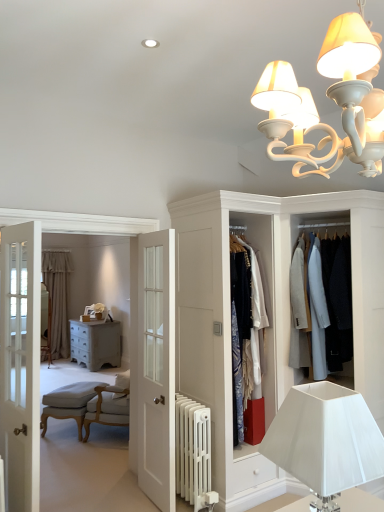
What is the approximate height of beige fabric curtain at left?

beige fabric curtain at left is 2.30 meters in height.

This screenshot has height=512, width=384. I want to click on white painted radiator at lower center, so click(192, 448).

What is the approximate width of silky fabric dress at center, which is counted as the 2th clothing, starting from the right?

silky fabric dress at center, which is counted as the 2th clothing, starting from the right, is 41.97 centimeters in width.

Describe the element at coordinates (68, 403) in the screenshot. I see `light beige fabric armchair at lower left` at that location.

Image resolution: width=384 pixels, height=512 pixels. What do you see at coordinates (156, 368) in the screenshot?
I see `white glossy door at center` at bounding box center [156, 368].

Measure the distance between light gray wool coat at center, marked as the second clothing in a left-to-right arrangement, and camera.

The depth of light gray wool coat at center, marked as the second clothing in a left-to-right arrangement, is 3.24 meters.

The image size is (384, 512). What do you see at coordinates (328, 304) in the screenshot?
I see `light gray wool coat at center, which is the first clothing from right to left` at bounding box center [328, 304].

Identify the location of white fabric lampshade at lower right, placed as the 1th lamp when sorted from bottom to top. (325, 441).

Where is `beige fabric curtain at left`? The image size is (384, 512). beige fabric curtain at left is located at coordinates (57, 298).

From the picture: Which of these two, white glossy door at center or distressed gray chest of drawers at center, is thinner?

white glossy door at center.

Is white glossy door at center inside the boundaries of distressed gray chest of drawers at center, or outside?

white glossy door at center exists outside the volume of distressed gray chest of drawers at center.

From the image's perspective, is white glossy door at center under distressed gray chest of drawers at center?

Actually, white glossy door at center appears above distressed gray chest of drawers at center in the image.

Can you tell me how much white glossy door at center and distressed gray chest of drawers at center differ in facing direction?

2.76 degrees.

Would you say beige fabric curtain at left is to the left or to the right of silky fabric dress at center, marked as the 1th clothing in a left-to-right arrangement, in the picture?

Based on their positions, beige fabric curtain at left is located to the left of silky fabric dress at center, marked as the 1th clothing in a left-to-right arrangement.

Which object is wider, beige fabric curtain at left or silky fabric dress at center, marked as the 1th clothing in a left-to-right arrangement?

silky fabric dress at center, marked as the 1th clothing in a left-to-right arrangement, is wider.

From the image's perspective, is beige fabric curtain at left located above or below silky fabric dress at center, which is counted as the 2th clothing, starting from the right?

beige fabric curtain at left is below silky fabric dress at center, which is counted as the 2th clothing, starting from the right.

From the picture: Is silky fabric dress at center, marked as the 1th clothing in a left-to-right arrangement, at the back of beige fabric curtain at left?

No, beige fabric curtain at left is not facing the opposite direction of silky fabric dress at center, marked as the 1th clothing in a left-to-right arrangement.

Considering the positions of objects white matte chandelier at upper center, which appears as the 2th lamp when ordered from the bottom, and white glossy door at center in the image provided, who is in front, white matte chandelier at upper center, which appears as the 2th lamp when ordered from the bottom, or white glossy door at center?

Positioned in front is white matte chandelier at upper center, which appears as the 2th lamp when ordered from the bottom.

Who is taller, white matte chandelier at upper center, the 1th lamp viewed from the top, or white glossy door at center?

Standing taller between the two is white glossy door at center.

Can you see white glossy door at center touching beige fabric curtain at left?

There is a gap between white glossy door at center and beige fabric curtain at left.

Does white glossy door at center come behind beige fabric curtain at left?

No, it is not.

Is point (139, 465) closer or farther from the camera than point (53, 257)?

Point (139, 465).

From the image's perspective, is silky fabric dress at center, marked as the 1th clothing in a left-to-right arrangement, beneath white painted radiator at lower center?

Incorrect, from the image's perspective, silky fabric dress at center, marked as the 1th clothing in a left-to-right arrangement, is higher than white painted radiator at lower center.

Considering the relative sizes of silky fabric dress at center, which is counted as the 2th clothing, starting from the right, and white painted radiator at lower center in the image provided, is silky fabric dress at center, which is counted as the 2th clothing, starting from the right, shorter than white painted radiator at lower center?

Incorrect, the height of silky fabric dress at center, which is counted as the 2th clothing, starting from the right, does not fall short of that of white painted radiator at lower center.

Who is smaller, silky fabric dress at center, which is counted as the 2th clothing, starting from the right, or white painted radiator at lower center?

white painted radiator at lower center is smaller.

How different are the orientations of silky fabric dress at center, which is counted as the 2th clothing, starting from the right, and white painted radiator at lower center in degrees?

The angle between the facing direction of silky fabric dress at center, which is counted as the 2th clothing, starting from the right, and the facing direction of white painted radiator at lower center is 3.83 degrees.

Based on their sizes in the image, would you say white painted radiator at lower center is bigger or smaller than silky fabric dress at center, marked as the 1th clothing in a left-to-right arrangement?

Clearly, white painted radiator at lower center is smaller in size than silky fabric dress at center, marked as the 1th clothing in a left-to-right arrangement.

Identify the location of radiator that is below the silky fabric dress at center, marked as the 1th clothing in a left-to-right arrangement (from the image's perspective). The image size is (384, 512). (192, 448).

Are white painted radiator at lower center and silky fabric dress at center, which is counted as the 2th clothing, starting from the right, making contact?

No, white painted radiator at lower center is not touching silky fabric dress at center, which is counted as the 2th clothing, starting from the right.

Does white painted radiator at lower center turn towards silky fabric dress at center, marked as the 1th clothing in a left-to-right arrangement?

No, white painted radiator at lower center is not aimed at silky fabric dress at center, marked as the 1th clothing in a left-to-right arrangement.

Considering the relative sizes of white glossy door at center and white painted radiator at lower center in the image provided, is white glossy door at center bigger than white painted radiator at lower center?

Correct, white glossy door at center is larger in size than white painted radiator at lower center.

Could white painted radiator at lower center be considered to be inside white glossy door at center?

No, white painted radiator at lower center is located outside of white glossy door at center.

Is white glossy door at center oriented towards white painted radiator at lower center?

Yes, white glossy door at center is facing white painted radiator at lower center.

Is white glossy door at center not near white painted radiator at lower center?

white glossy door at center is near white painted radiator at lower center, not far away.

Where is `the chest of drawers that appears behind the white glossy door at center`? The height and width of the screenshot is (512, 384). the chest of drawers that appears behind the white glossy door at center is located at coordinates (95, 343).

Locate an element on the screen. This screenshot has height=512, width=384. the 1st clothing above the beige fabric curtain at left (from the image's perspective) is located at coordinates (248, 335).

When comparing their distances from distressed gray chest of drawers at center, does white matte chandelier at upper center, which appears as the 2th lamp when ordered from the bottom, or beige fabric curtain at left seem further?

white matte chandelier at upper center, which appears as the 2th lamp when ordered from the bottom, is further to distressed gray chest of drawers at center.

Looking at the image, which one is located closer to light gray wool coat at center, which is the first clothing from right to left, light beige fabric armchair at lower left or beige fabric curtain at left?

light beige fabric armchair at lower left.

Looking at the image, which one is located closer to silky fabric dress at center, marked as the 1th clothing in a left-to-right arrangement, light beige fabric armchair at lower left or white fabric lampshade at lower right, the 2th lamp from the top?

white fabric lampshade at lower right, the 2th lamp from the top, is closer to silky fabric dress at center, marked as the 1th clothing in a left-to-right arrangement.

From the image, which object appears to be farther from white fabric lampshade at lower right, placed as the 1th lamp when sorted from bottom to top, silky fabric dress at center, marked as the 1th clothing in a left-to-right arrangement, or white painted radiator at lower center?

silky fabric dress at center, marked as the 1th clothing in a left-to-right arrangement, is further to white fabric lampshade at lower right, placed as the 1th lamp when sorted from bottom to top.

Considering their positions, is white painted radiator at lower center positioned closer to distressed gray chest of drawers at center than light beige fabric armchair at lower left?

light beige fabric armchair at lower left is positioned closer to the anchor distressed gray chest of drawers at center.

Estimate the real-world distances between objects in this image. Which object is further from white glossy door at center, silky fabric dress at center, which is counted as the 2th clothing, starting from the right, or white fabric lampshade at lower right, placed as the 1th lamp when sorted from bottom to top?

Among the two, white fabric lampshade at lower right, placed as the 1th lamp when sorted from bottom to top, is located further to white glossy door at center.

Which object lies nearer to the anchor point beige fabric curtain at left, white fabric lampshade at lower right, placed as the 1th lamp when sorted from bottom to top, or distressed gray chest of drawers at center?

distressed gray chest of drawers at center is positioned closer to the anchor beige fabric curtain at left.

Looking at the image, which one is located closer to white glossy door at center, distressed gray chest of drawers at center or light beige fabric armchair at lower left?

Based on the image, light beige fabric armchair at lower left appears to be nearer to white glossy door at center.

What are the coordinates of `armchair between white glossy door at center and beige fabric curtain at left in the front-back direction` in the screenshot? It's located at (68, 403).

This screenshot has width=384, height=512. What are the coordinates of `armchair between white painted radiator at lower center and beige fabric curtain at left from front to back` in the screenshot? It's located at (68, 403).

Where is `the chest of drawers positioned between light gray wool coat at center, which is the first clothing from right to left, and beige fabric curtain at left from near to far`? The height and width of the screenshot is (512, 384). the chest of drawers positioned between light gray wool coat at center, which is the first clothing from right to left, and beige fabric curtain at left from near to far is located at coordinates (95, 343).

Identify the location of radiator positioned between white matte chandelier at upper center, which appears as the 2th lamp when ordered from the bottom, and light beige fabric armchair at lower left from near to far. Image resolution: width=384 pixels, height=512 pixels. (192, 448).